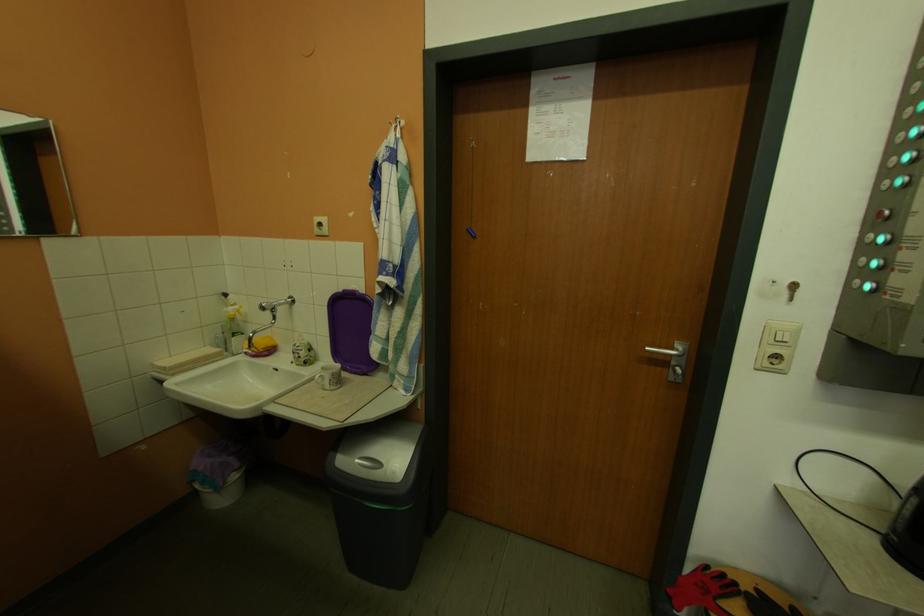
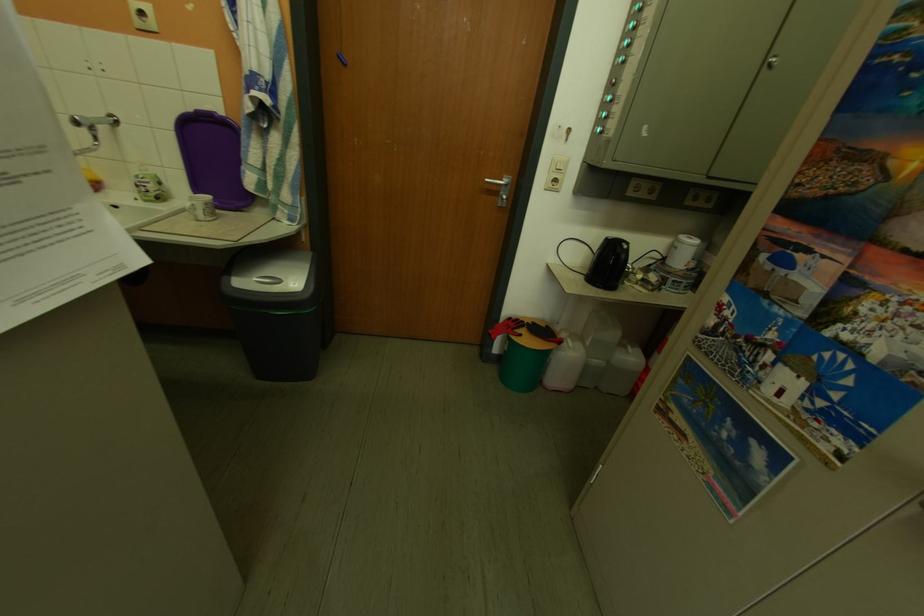
The point at (354, 293) is marked in the first image. Where is the corresponding point in the second image?

(203, 113)